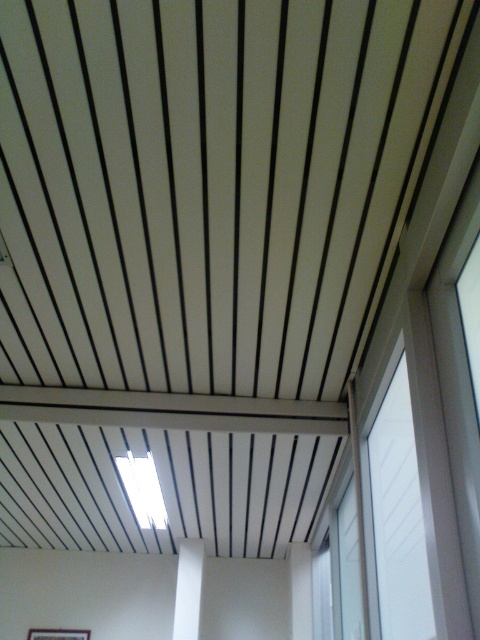
This screenshot has height=640, width=480. Identify the location of white glossy window at right. (395, 518).

Which is more to the right, white glossy window at right or white matte pillar at center?

white glossy window at right

Between point (363, 465) and point (189, 586), which one is positioned behind?

Positioned behind is point (189, 586).

You are a GUI agent. You are given a task and a screenshot of the screen. Output one action in this format:
    pyautogui.click(x=<x>, y=<y>)
    Task: Click on the white glossy window at right
    
    Given the screenshot: What is the action you would take?
    pyautogui.click(x=395, y=518)